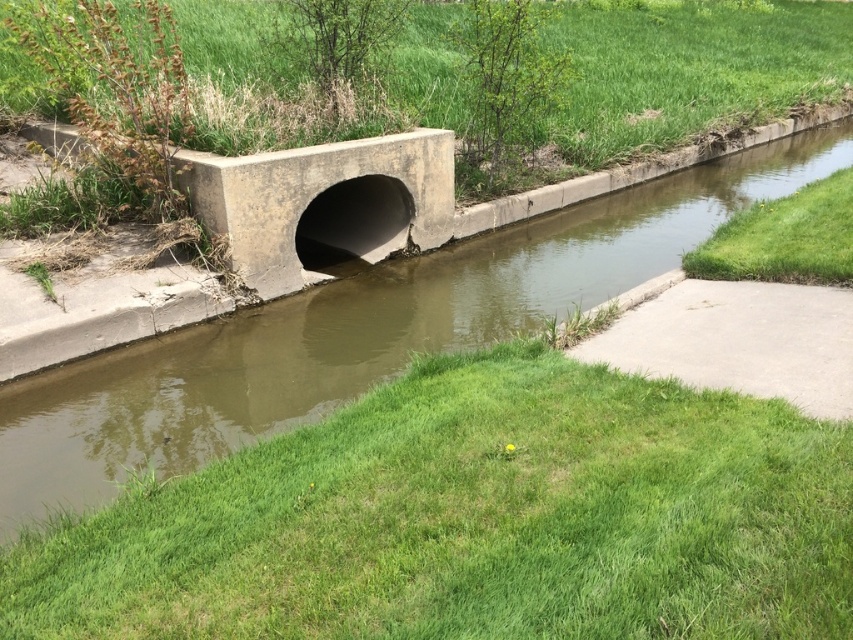
From the picture: You are a landscape architect designing a new pathway. You notice the brown concrete stream at center and the green grass at lower right in the scene. Which of these two features is wider?

The brown concrete stream at center is wider than the green grass at lower right.

You are a landscape architect designing a drainage system. You have to ensure that the brown concrete stream at center and the green grass at lower right are at appropriate heights. Based on the scene, which one is taller?

The brown concrete stream at center is much taller as green grass at lower right.